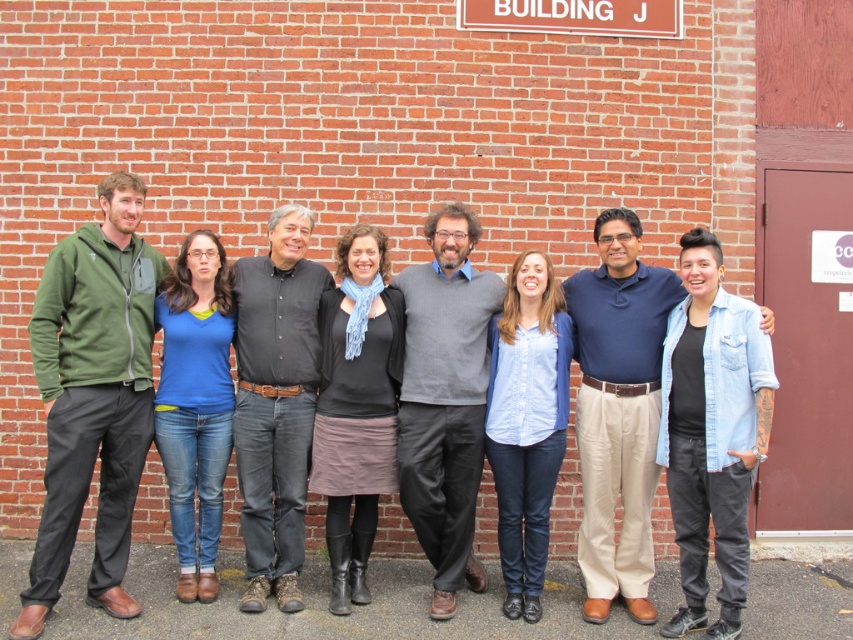
Is olive green fleece jacket at left to the right of black cotton shirt at center from the viewer's perspective?

Incorrect, olive green fleece jacket at left is not on the right side of black cotton shirt at center.

Is olive green fleece jacket at left thinner than black cotton shirt at center?

Incorrect, olive green fleece jacket at left's width is not less than black cotton shirt at center's.

Locate an element on the screen. This screenshot has width=853, height=640. olive green fleece jacket at left is located at coordinates (93, 396).

Is gray sweater at center above black cotton shirt at center?

No.

Is gray sweater at center thinner than black cotton shirt at center?

In fact, gray sweater at center might be wider than black cotton shirt at center.

Is point (439, 486) more distant than point (265, 456)?

No, (439, 486) is closer to viewer.

Find the location of `gray sweater at center`. gray sweater at center is located at coordinates (445, 400).

The height and width of the screenshot is (640, 853). What do you see at coordinates (618, 410) in the screenshot? I see `blue shirt at center` at bounding box center [618, 410].

Does blue shirt at center have a larger size compared to gray sweater at center?

Yes.

Locate an element on the screen. This screenshot has height=640, width=853. blue shirt at center is located at coordinates (618, 410).